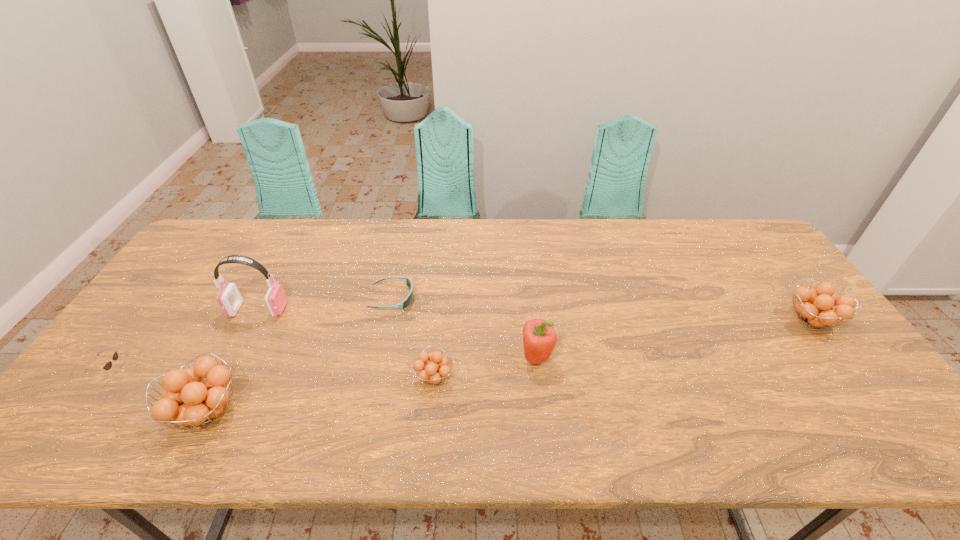
If we want them evenly spaced by inserting an extra orange_(fruit) among them, please locate a free spot for this new orange_(fruit). Please provide its 2D coordinates. Your answer should be formatted as a tuple, i.e. [(x, y)], where the tuple contains the x and y coordinates of a point satisfying the conditions above.

[(635, 347)]